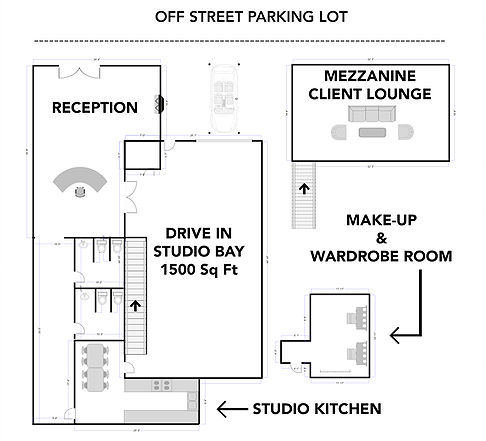
Locate an element on the screen. The width and height of the screenshot is (486, 441). double door is located at coordinates (79, 68), (126, 198).